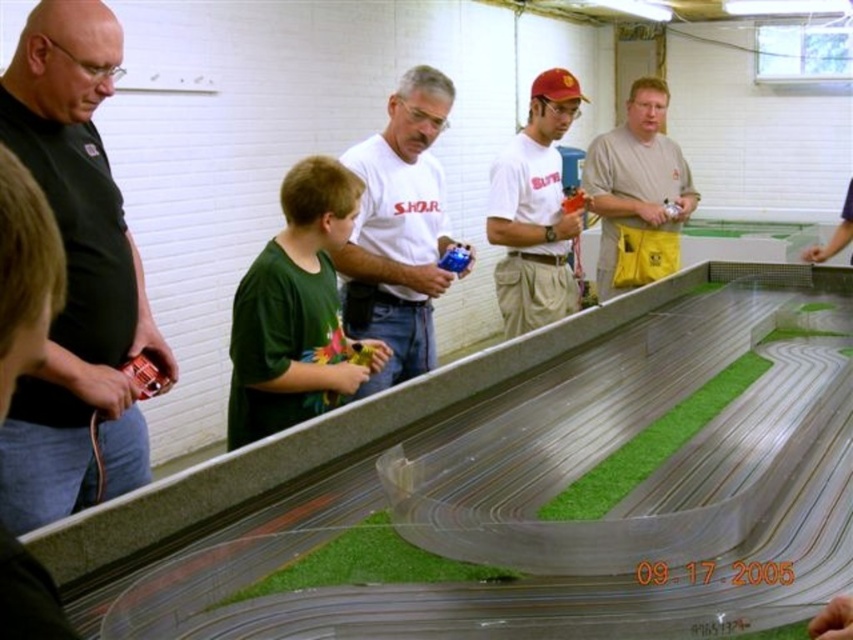
Question: Among these objects, which one is farthest from the camera?

Choices:
 (A) blue plastic toy at center
 (B) matte black shirt at left
 (C) matte white t-shirt at center
 (D) white matte shirt at center

Answer: (C)

Question: Among these objects, which one is farthest from the camera?

Choices:
 (A) blue plastic toy at center
 (B) light brown cotton shirt at center

Answer: (B)

Question: Estimate the real-world distances between objects in this image. Which object is closer to the blue plastic toy at center?

Choices:
 (A) matte black shirt at left
 (B) white matte shirt at center

Answer: (B)

Question: Is white matte shirt at center to the left of blue plastic toy at center from the viewer's perspective?

Choices:
 (A) yes
 (B) no

Answer: (A)

Question: Can you confirm if matte black shirt at left is positioned below blue plastic toy at center?

Choices:
 (A) yes
 (B) no

Answer: (A)

Question: Is matte black shirt at left to the left of light brown cotton shirt at center from the viewer's perspective?

Choices:
 (A) no
 (B) yes

Answer: (B)